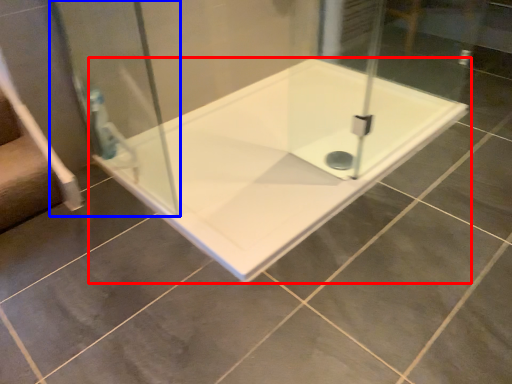
Question: Which object is further to the camera taking this photo, bathtub (highlighted by a red box) or shower door (highlighted by a blue box)?

Choices:
 (A) bathtub
 (B) shower door

Answer: (A)